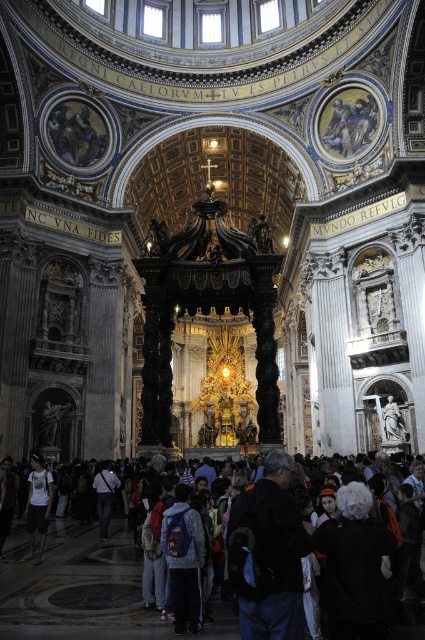
What is the relationship between the width of the dark clothing crowd at lower center and the denim jacket at lower left in the cathedral scene?

The dark clothing crowd at lower center is wider than the denim jacket at lower left.

You are a visitor at the cathedral and notice two items on the floor. You see the dark gray hoodie at lower center and the denim jacket at lower left. Which item is smaller in size?

The dark gray hoodie at lower center has a smaller size compared to the denim jacket at lower left, so the dark gray hoodie at lower center is smaller.